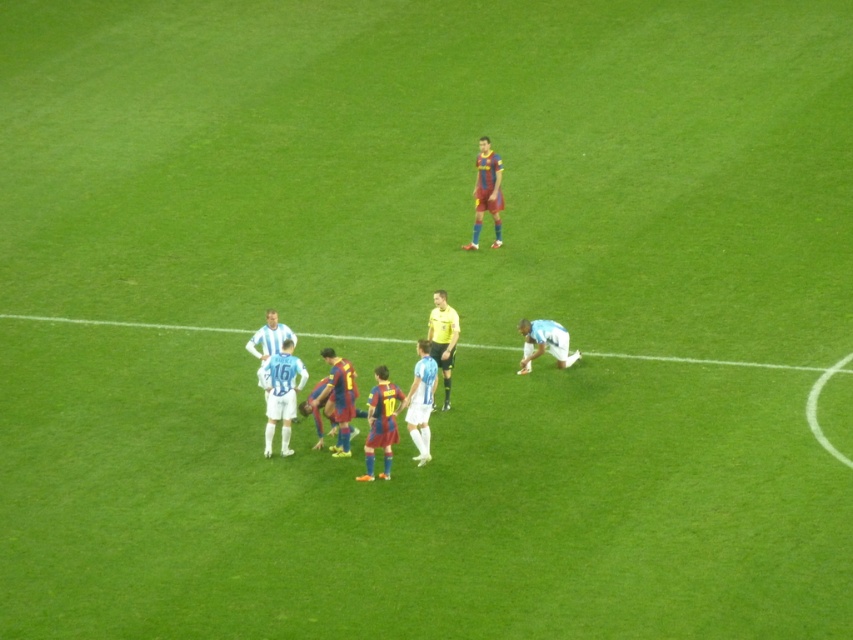
Looking at this image, you are a soccer coach observing the field. You notice the white fabric line at lower center and the maroon jersey at upper center. Which object occupies more space in the image?

The white fabric line at lower center has a larger size compared to the maroon jersey at upper center, so it occupies more space in the image.

In the scene shown: You are a photographer trying to capture a photo of the soccer match. You want to ensure both the white matte jersey at lower right and the light blue jersey at center are clearly visible in the frame. Based on their sizes in the image, which jersey should you focus on to ensure it stands out more in the photo?

The white matte jersey at lower right is much taller than the light blue jersey at center, so focusing on it will make it stand out more in the photo.

You are a soccer player trying to locate the ball during a break in play. The ball is at the point marked as point (486, 193). Which object in the scene is the ball closest to?

The ball at point (486, 193) is on the maroon jersey at upper center, so it is closest to that object.